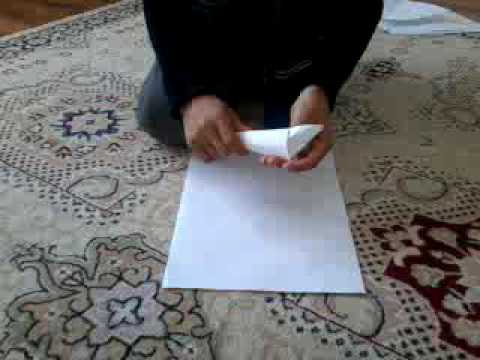
Locate an element on the screen. The image size is (480, 360). paper on rug in front of person is located at coordinates (252, 218).